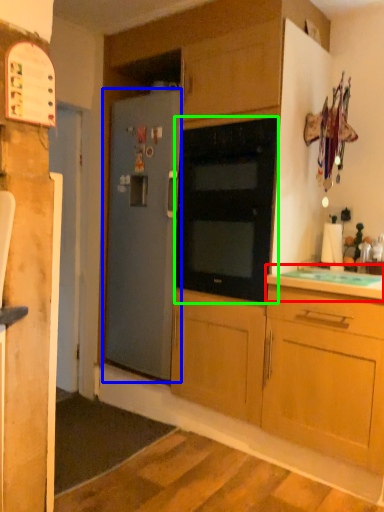
Question: Based on their relative distances, which object is nearer to countertop (highlighted by a red box)? Choose from refrigerator (highlighted by a blue box) and oven (highlighted by a green box).

Choices:
 (A) refrigerator
 (B) oven

Answer: (B)